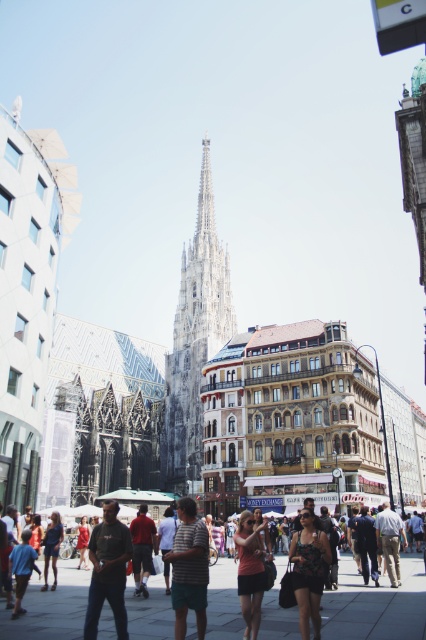
Question: Can you confirm if stone spire at center is positioned above blue shirt at lower left?

Choices:
 (A) yes
 (B) no

Answer: (A)

Question: Among these points, which one is nearest to the camera?

Choices:
 (A) (85, 516)
 (B) (117, 579)
 (C) (17, 612)
 (D) (187, 582)

Answer: (D)

Question: Which of the following is the closest to the observer?

Choices:
 (A) striped fabric shirt at center
 (B) matte pink shirt at center
 (C) dark blue jeans at center
 (D) matte red dress at center

Answer: (A)

Question: Estimate the real-world distances between objects in this image. Which object is closer to the matte red dress at center?

Choices:
 (A) dark blue jeans at center
 (B) dark gray jeans at lower left
 (C) striped fabric shirt at center
 (D) blue shirt at lower left

Answer: (A)

Question: Is matte black dress at lower center below blue shirt at lower left?

Choices:
 (A) no
 (B) yes

Answer: (A)

Question: Is striped fabric shirt at center below denim shorts at lower left?

Choices:
 (A) yes
 (B) no

Answer: (B)